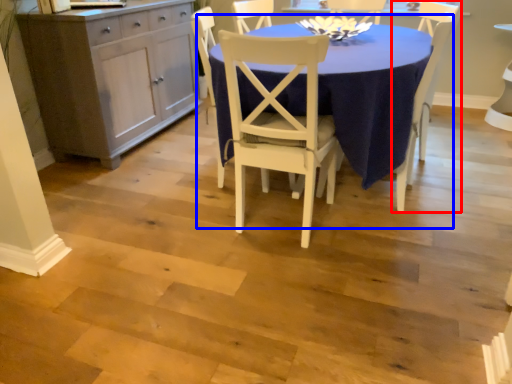
Question: Which point is further to the camera, chair (highlighted by a red box) or kitchen & dining room table (highlighted by a blue box)?

Choices:
 (A) chair
 (B) kitchen & dining room table

Answer: (A)